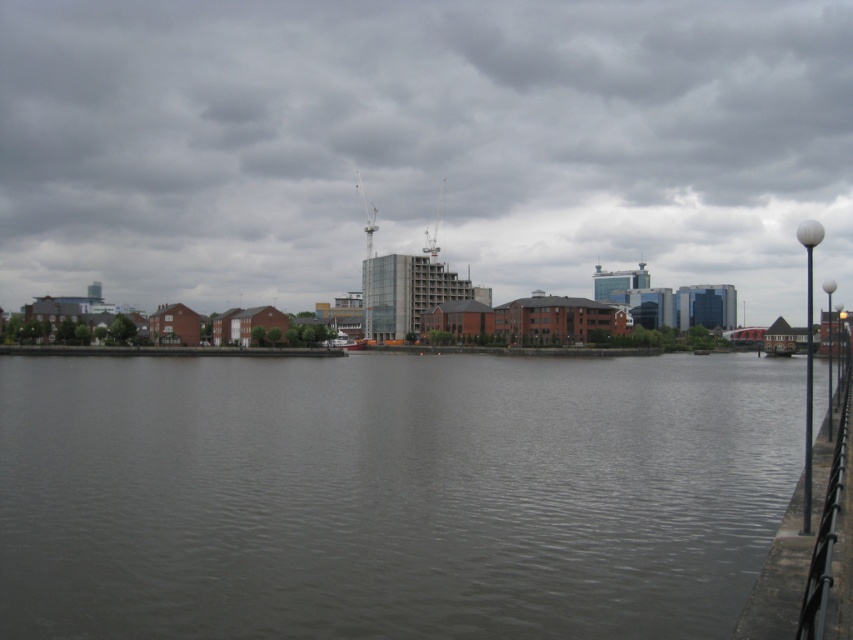
Does transparent glass buildings at center have a lesser width compared to gray concrete river at center?

No, transparent glass buildings at center is not thinner than gray concrete river at center.

Is transparent glass buildings at center to the right of gray concrete river at center from the viewer's perspective?

Incorrect, transparent glass buildings at center is not on the right side of gray concrete river at center.

You are a GUI agent. You are given a task and a screenshot of the screen. Output one action in this format:
    pyautogui.click(x=<x>, y=<y>)
    Task: Click on the transparent glass buildings at center
    
    Given the screenshot: What is the action you would take?
    pyautogui.click(x=421, y=145)